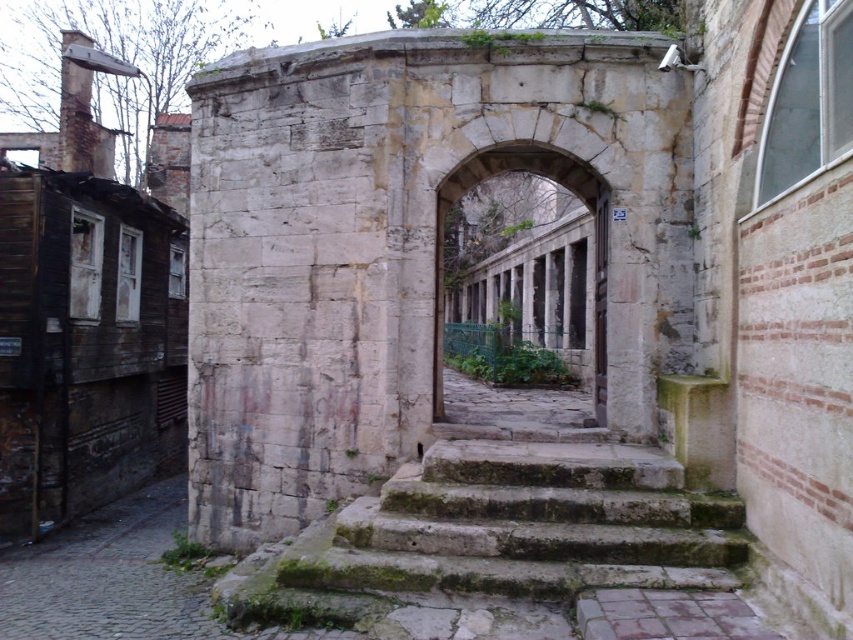
Question: Can you confirm if green mossy stone stairs at center is positioned to the left of stone archway at center?

Choices:
 (A) yes
 (B) no

Answer: (A)

Question: Which of the following is the closest to the observer?

Choices:
 (A) green mossy stone stairs at center
 (B) stone archway at center

Answer: (A)

Question: Which point is closer to the camera?

Choices:
 (A) (593, 211)
 (B) (338, 552)

Answer: (B)

Question: Is green mossy stone stairs at center bigger than stone archway at center?

Choices:
 (A) no
 (B) yes

Answer: (A)

Question: Does green mossy stone stairs at center have a smaller size compared to stone archway at center?

Choices:
 (A) yes
 (B) no

Answer: (A)